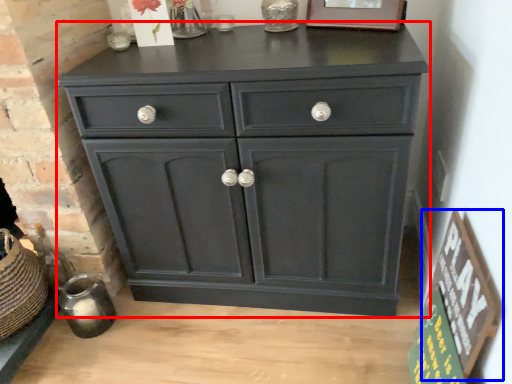
Question: Which object is further to the camera taking this photo, chest of drawers (highlighted by a red box) or bulletin board (highlighted by a blue box)?

Choices:
 (A) chest of drawers
 (B) bulletin board

Answer: (A)